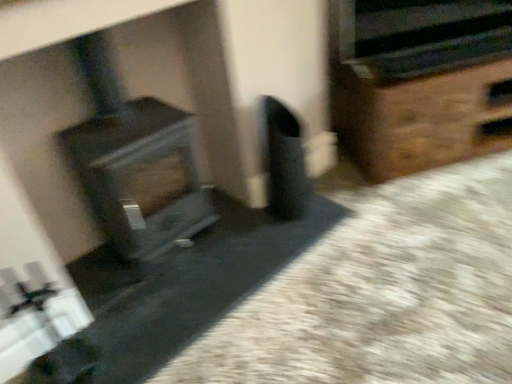
Question: Does wood grain stove at left have a lesser width compared to metallic silver stereo at upper right?

Choices:
 (A) no
 (B) yes

Answer: (A)

Question: Is wood grain stove at left positioned behind metallic silver stereo at upper right?

Choices:
 (A) no
 (B) yes

Answer: (A)

Question: Is metallic silver stereo at upper right inside wood grain stove at left?

Choices:
 (A) yes
 (B) no

Answer: (B)

Question: Can we say wood grain stove at left lies outside metallic silver stereo at upper right?

Choices:
 (A) yes
 (B) no

Answer: (A)

Question: Is wood grain stove at left turned away from metallic silver stereo at upper right?

Choices:
 (A) yes
 (B) no

Answer: (B)

Question: Considering the positions of point (506, 4) and point (394, 61), is point (506, 4) closer or farther from the camera than point (394, 61)?

Choices:
 (A) closer
 (B) farther

Answer: (B)

Question: Looking at the image, does metallic silver stereo at upper right seem bigger or smaller compared to brown wooden chest at right?

Choices:
 (A) small
 (B) big

Answer: (A)

Question: Is metallic silver stereo at upper right inside the boundaries of brown wooden chest at right, or outside?

Choices:
 (A) inside
 (B) outside

Answer: (B)

Question: Based on their positions, is metallic silver stereo at upper right located to the left or right of brown wooden chest at right?

Choices:
 (A) left
 (B) right

Answer: (A)

Question: Based on their sizes in the image, would you say wood grain stove at left is bigger or smaller than metallic silver stereo at upper right?

Choices:
 (A) big
 (B) small

Answer: (A)

Question: Is wood grain stove at left taller or shorter than metallic silver stereo at upper right?

Choices:
 (A) tall
 (B) short

Answer: (A)

Question: In the image, is wood grain stove at left on the left side or the right side of metallic silver stereo at upper right?

Choices:
 (A) left
 (B) right

Answer: (A)

Question: From a real-world perspective, relative to metallic silver stereo at upper right, is wood grain stove at left vertically above or below?

Choices:
 (A) below
 (B) above

Answer: (A)

Question: From the image's perspective, is brown wooden chest at right located above or below metallic silver stereo at upper right?

Choices:
 (A) below
 (B) above

Answer: (A)

Question: Visually, is brown wooden chest at right positioned to the left or to the right of metallic silver stereo at upper right?

Choices:
 (A) right
 (B) left

Answer: (A)